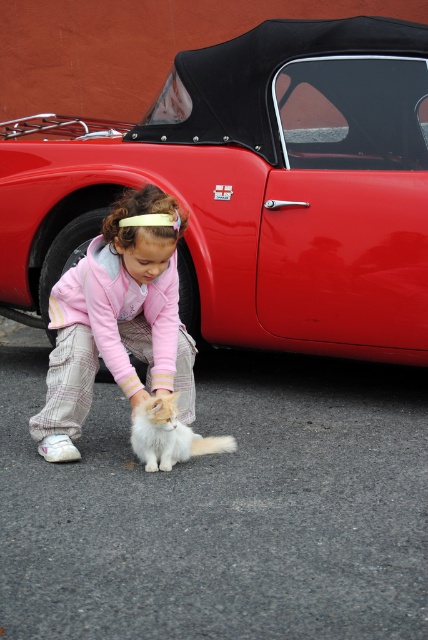
Does shiny red car at center have a larger size compared to white fluffy cat at lower center?

Correct, shiny red car at center is larger in size than white fluffy cat at lower center.

Does shiny red car at center have a smaller size compared to white fluffy cat at lower center?

No, shiny red car at center is not smaller than white fluffy cat at lower center.

Who is more distant from viewer, (309, 292) or (172, 406)?

The point (309, 292) is behind.

You are a GUI agent. You are given a task and a screenshot of the screen. Output one action in this format:
    pyautogui.click(x=<x>, y=<y>)
    Task: Click on the shiny red car at center
    The height and width of the screenshot is (640, 428).
    Given the screenshot: What is the action you would take?
    pyautogui.click(x=253, y=188)

Is point (152, 346) farther from camera compared to point (157, 422)?

Yes, point (152, 346) is behind point (157, 422).

Can you confirm if pink fleece jacket at center is positioned to the right of white fluffy cat at lower center?

Incorrect, pink fleece jacket at center is not on the right side of white fluffy cat at lower center.

Is point (157, 243) farther from camera compared to point (154, 433)?

No, (157, 243) is closer to viewer.

This screenshot has height=640, width=428. I want to click on pink fleece jacket at center, so click(118, 321).

Is shiny red car at center shorter than pink fleece jacket at center?

No, shiny red car at center is not shorter than pink fleece jacket at center.

Where is `shiny red car at center`? The width and height of the screenshot is (428, 640). shiny red car at center is located at coordinates (253, 188).